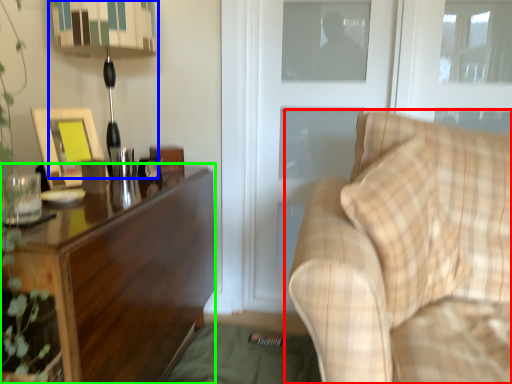
Question: Based on their relative distances, which object is farther from studio couch (highlighted by a red box)? Choose from table lamp (highlighted by a blue box) and desk (highlighted by a green box).

Choices:
 (A) table lamp
 (B) desk

Answer: (A)